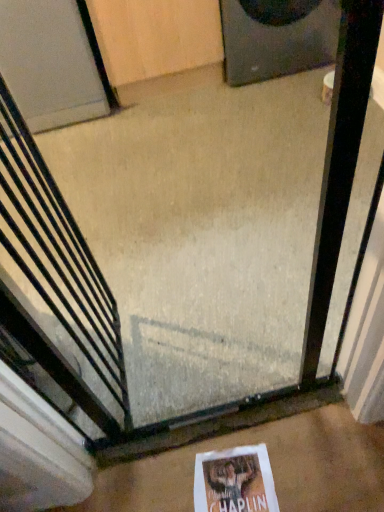
Question: From the image's perspective, is white matte door at upper left on top of black matte speaker at upper right?

Choices:
 (A) no
 (B) yes

Answer: (A)

Question: Does white matte door at upper left have a greater width compared to black matte speaker at upper right?

Choices:
 (A) yes
 (B) no

Answer: (B)

Question: Is white matte door at upper left positioned behind black matte speaker at upper right?

Choices:
 (A) no
 (B) yes

Answer: (A)

Question: From a real-world perspective, is white matte door at upper left on black matte speaker at upper right?

Choices:
 (A) yes
 (B) no

Answer: (A)

Question: Is white matte door at upper left looking in the opposite direction of black matte speaker at upper right?

Choices:
 (A) yes
 (B) no

Answer: (B)

Question: From a real-world perspective, is white concrete at center positioned above or below white matte door at upper left?

Choices:
 (A) above
 (B) below

Answer: (B)

Question: In terms of height, does white concrete at center look taller or shorter compared to white matte door at upper left?

Choices:
 (A) tall
 (B) short

Answer: (B)

Question: Which is correct: white concrete at center is inside white matte door at upper left, or outside of it?

Choices:
 (A) outside
 (B) inside

Answer: (A)

Question: Considering their positions, is white concrete at center located in front of or behind white matte door at upper left?

Choices:
 (A) front
 (B) behind

Answer: (A)

Question: In terms of width, does white matte door at upper left look wider or thinner when compared to white concrete at center?

Choices:
 (A) thin
 (B) wide

Answer: (B)

Question: Is white matte door at upper left in front of or behind white concrete at center in the image?

Choices:
 (A) behind
 (B) front

Answer: (A)

Question: Would you say white matte door at upper left is to the left or to the right of white concrete at center in the picture?

Choices:
 (A) left
 (B) right

Answer: (A)

Question: In terms of size, does white matte door at upper left appear bigger or smaller than white concrete at center?

Choices:
 (A) small
 (B) big

Answer: (B)

Question: From the image's perspective, is white matte door at upper left above or below black matte speaker at upper right?

Choices:
 (A) above
 (B) below

Answer: (B)

Question: Considering the positions of white matte door at upper left and black matte speaker at upper right in the image, is white matte door at upper left bigger or smaller than black matte speaker at upper right?

Choices:
 (A) big
 (B) small

Answer: (A)